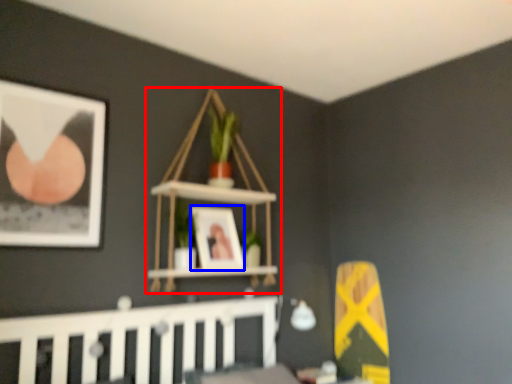
Question: Among these objects, which one is nearest to the camera, shelf (highlighted by a red box) or picture frame (highlighted by a blue box)?

Choices:
 (A) shelf
 (B) picture frame

Answer: (A)